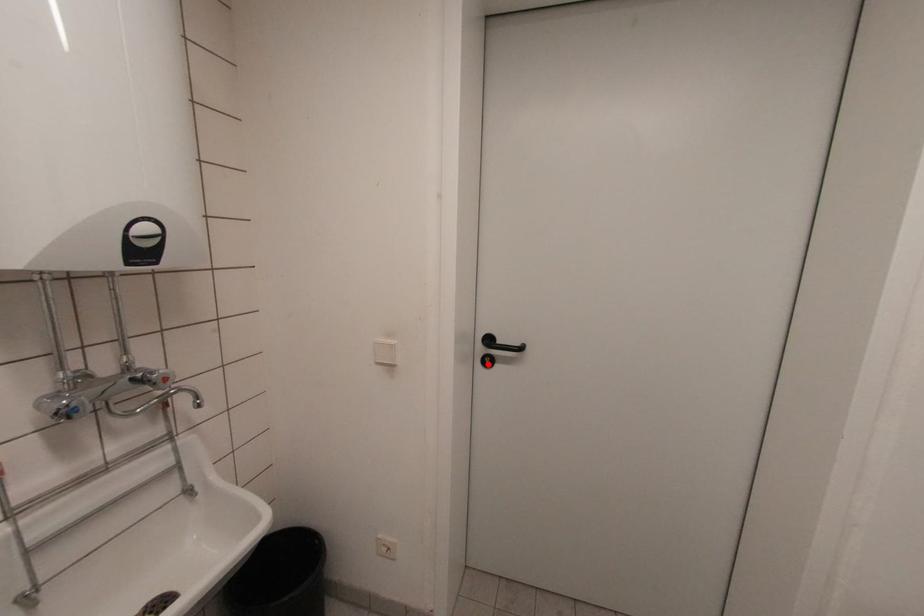
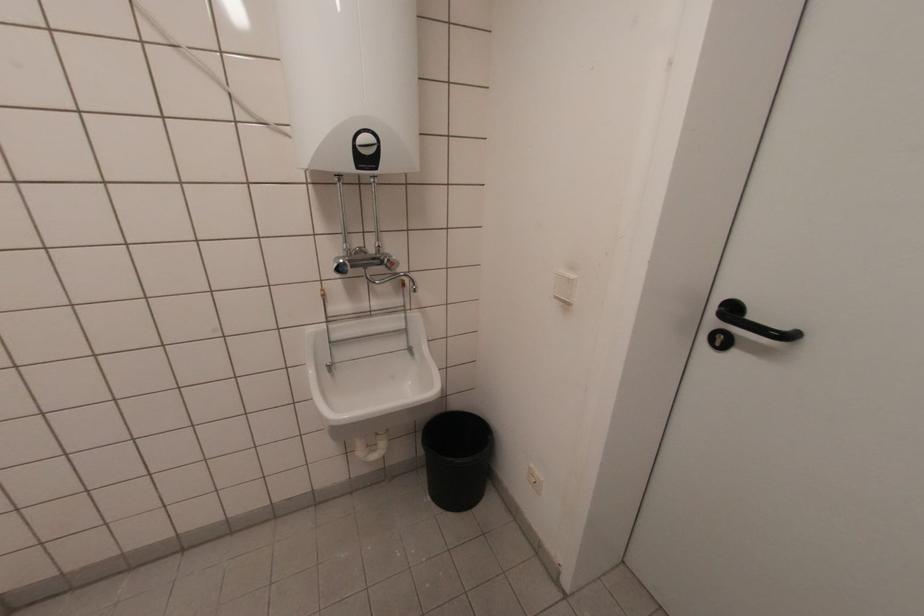
Find the pixel in the second image that matches the highlighted location in the first image.

(719, 344)